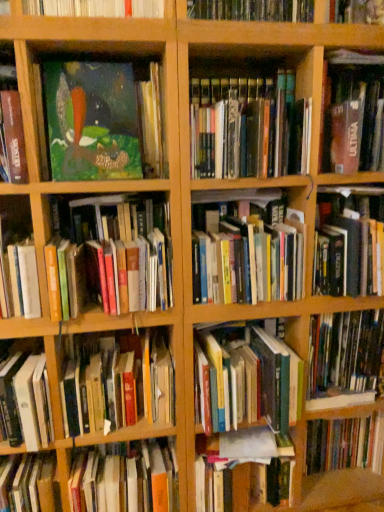
Question: Would you say hardcover book at center, which is the fourth book from top to bottom, is part of matte green painting at upper left, marked as the fourteenth book in a bottom-to-top arrangement,'s contents?

Choices:
 (A) yes
 (B) no

Answer: (B)

Question: From a real-world perspective, is matte green painting at upper left, marked as the fourteenth book in a bottom-to-top arrangement, positioned under hardcover book at center, which ranks as the 12th book in bottom-to-top order, based on gravity?

Choices:
 (A) yes
 (B) no

Answer: (B)

Question: Is there a large distance between matte green painting at upper left, marked as the fourteenth book in a bottom-to-top arrangement, and hardcover book at center, which is the fourth book from top to bottom?

Choices:
 (A) no
 (B) yes

Answer: (A)

Question: From the image's perspective, is matte green painting at upper left, marked as the fourteenth book in a bottom-to-top arrangement, above hardcover book at center, which is the fourth book from top to bottom?

Choices:
 (A) yes
 (B) no

Answer: (A)

Question: Considering the relative positions of matte green painting at upper left, marked as the fourteenth book in a bottom-to-top arrangement, and hardcover book at center, which ranks as the 12th book in bottom-to-top order, in the image provided, is matte green painting at upper left, marked as the fourteenth book in a bottom-to-top arrangement, to the left of hardcover book at center, which ranks as the 12th book in bottom-to-top order, from the viewer's perspective?

Choices:
 (A) no
 (B) yes

Answer: (B)

Question: Is matte green painting at upper left, which is the second book from top to bottom, closer to camera compared to hardcover book at center, which is the fourth book from top to bottom?

Choices:
 (A) yes
 (B) no

Answer: (B)

Question: Is hardcover book at center right, marked as the 5th book in a top-to-bottom arrangement, far from hardcover books at center, placed as the tenth book when sorted from bottom to top?

Choices:
 (A) yes
 (B) no

Answer: (B)

Question: Is hardcover book at center right, the 11th book when ordered from bottom to top, shorter than hardcover books at center, placed as the tenth book when sorted from bottom to top?

Choices:
 (A) no
 (B) yes

Answer: (A)

Question: Considering the relative sizes of hardcover book at center right, marked as the 5th book in a top-to-bottom arrangement, and hardcover books at center, which is the sixth book from top to bottom, in the image provided, is hardcover book at center right, marked as the 5th book in a top-to-bottom arrangement, smaller than hardcover books at center, which is the sixth book from top to bottom,?

Choices:
 (A) yes
 (B) no

Answer: (B)

Question: Is hardcover book at center right, the 11th book when ordered from bottom to top, oriented towards hardcover books at center, which is the sixth book from top to bottom?

Choices:
 (A) yes
 (B) no

Answer: (B)

Question: Is hardcover book at center right, marked as the 5th book in a top-to-bottom arrangement, outside hardcover books at center, placed as the tenth book when sorted from bottom to top?

Choices:
 (A) yes
 (B) no

Answer: (A)

Question: Is hardcover book at center right, the 11th book when ordered from bottom to top, next to hardcover books at center, which is the sixth book from top to bottom, and touching it?

Choices:
 (A) yes
 (B) no

Answer: (B)

Question: Could wooden bookshelf at upper center, marked as the 1th shelf in a right-to-left arrangement, be considered to be inside hardcover book at lower left, the fourth book when ordered from bottom to top?

Choices:
 (A) yes
 (B) no

Answer: (B)